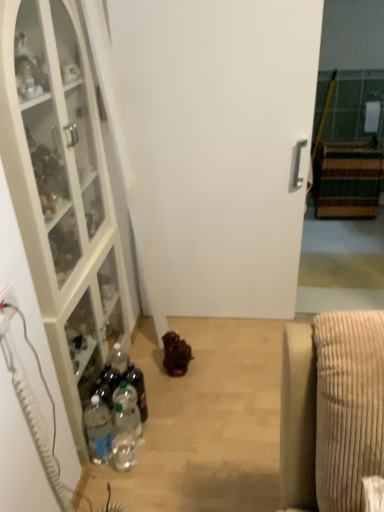
You are a GUI agent. You are given a task and a screenshot of the screen. Output one action in this format:
    pyautogui.click(x=<x>, y=<y>)
    Task: Click on the empty space that is in between white matte door at center and clear plastic bottle at center, the 1th bottle when ordered from right to left
    
    Given the screenshot: What is the action you would take?
    pyautogui.click(x=206, y=351)